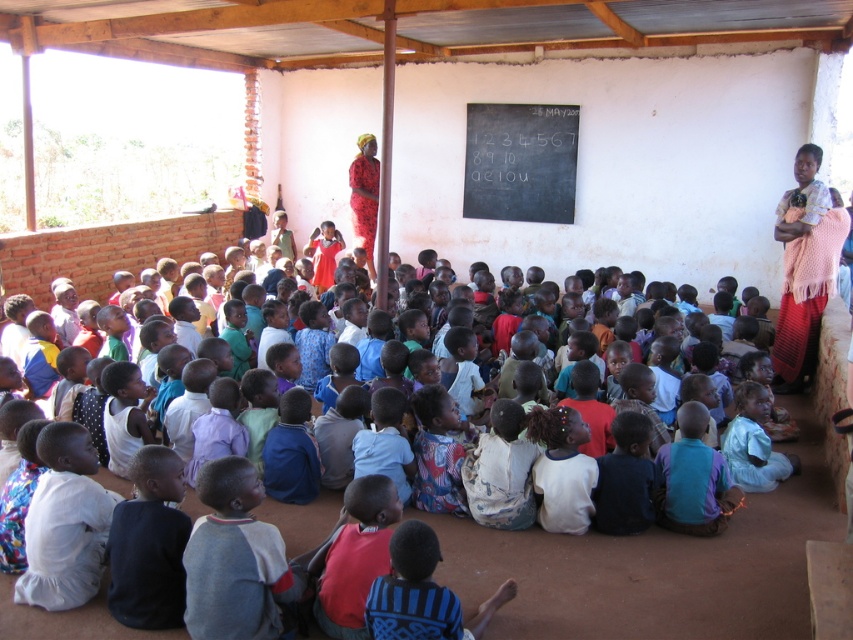
Which is below, light blue shirt at center or red fabric dress at upper center?

light blue shirt at center is lower down.

What do you see at coordinates (642, 573) in the screenshot? The image size is (853, 640). I see `light blue shirt at center` at bounding box center [642, 573].

What do you see at coordinates (642, 573) in the screenshot? This screenshot has width=853, height=640. I see `light blue shirt at center` at bounding box center [642, 573].

At what (x,y) coordinates should I click in order to perform the action: click on light blue shirt at center. Please return your answer as a coordinate pair (x, y). This screenshot has height=640, width=853. Looking at the image, I should click on (642, 573).

Looking at this image, how far apart are pink knitted shawl at upper right and red fabric dress at upper center?

The distance of pink knitted shawl at upper right from red fabric dress at upper center is 4.92 meters.

Can you confirm if pink knitted shawl at upper right is positioned below red fabric dress at upper center?

Indeed, pink knitted shawl at upper right is positioned under red fabric dress at upper center.

Is point (786, 236) closer to camera compared to point (374, 138)?

Yes, it is.

This screenshot has height=640, width=853. I want to click on pink knitted shawl at upper right, so click(x=805, y=264).

Does light blue shirt at center have a smaller size compared to black chalkboard at center?

Correct, light blue shirt at center occupies less space than black chalkboard at center.

Between light blue shirt at center and black chalkboard at center, which one is positioned lower?

light blue shirt at center is below.

Is point (496, 627) closer to camera compared to point (519, 212)?

Yes.

Where is `light blue shirt at center`? This screenshot has height=640, width=853. light blue shirt at center is located at coordinates (642, 573).